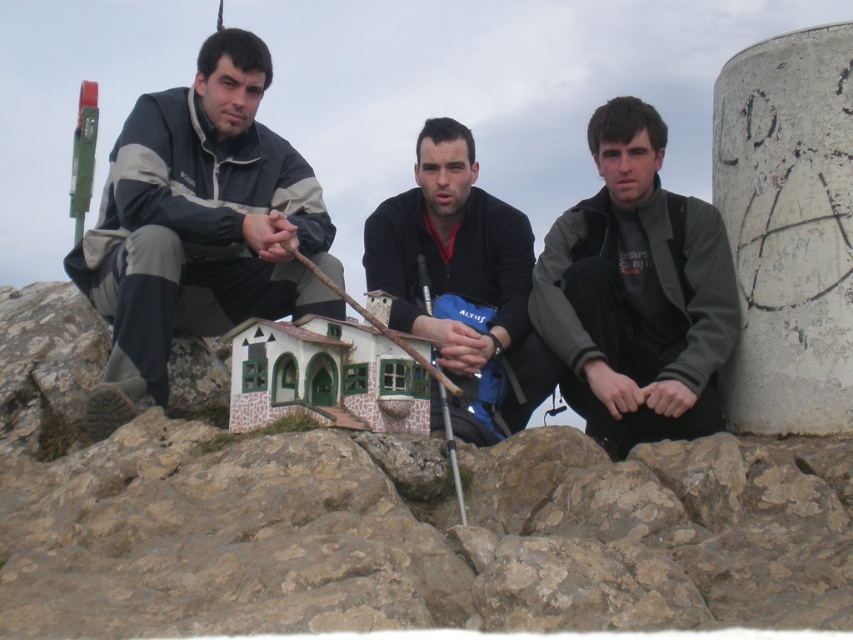
Looking at the scene, where is the white concrete pillar at upper right in relation to the dark gray jacket at center?

The white concrete pillar at upper right is positioned to the right of the dark gray jacket at center.

You are a photographer trying to capture the matte gray jacket at left and the white concrete pillar at upper right in the same frame. Based on their positions, which object is closer to the camera?

The matte gray jacket at left is positioned over the white concrete pillar at upper right, meaning it is closer to the camera.